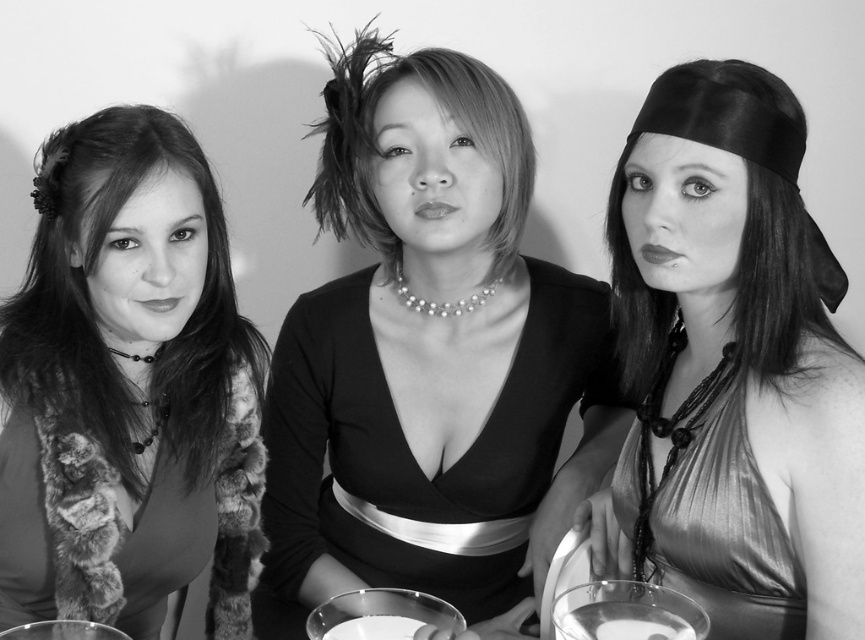
Question: Is the position of fur scarf at left less distant than that of satin metallic dress at right?

Choices:
 (A) no
 (B) yes

Answer: (B)

Question: Is fur vest at left above transparent glass at center?

Choices:
 (A) no
 (B) yes

Answer: (B)

Question: Estimate the real-world distances between objects in this image. Which object is farther from the transparent glass at center?

Choices:
 (A) clear glass at center
 (B) satin black headband at center

Answer: (B)

Question: Is satin metallic dress at right bigger than clear glass at center?

Choices:
 (A) no
 (B) yes

Answer: (B)

Question: Which of the following is the farthest from the observer?

Choices:
 (A) clear glass wine glass at lower center
 (B) fur vest at left
 (C) satin metallic dress at right

Answer: (B)

Question: Which of the following is the closest to the observer?

Choices:
 (A) pos(362,138)
 (B) pos(20,628)
 (C) pos(773,545)
 (D) pos(139,576)

Answer: (B)